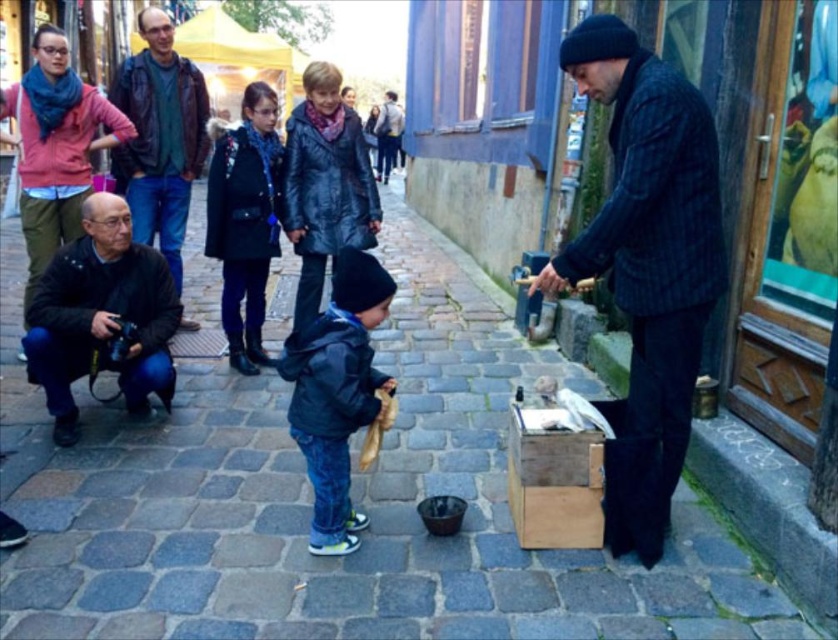
Who is positioned more to the right, dark blue textured jacket at right or dark blue denim jacket at center?

dark blue textured jacket at right is more to the right.

Does dark blue textured jacket at right appear on the left side of dark blue denim jacket at center?

No, dark blue textured jacket at right is not to the left of dark blue denim jacket at center.

Does point (643, 161) lie behind point (324, 378)?

No, it is not.

Where is `dark blue textured jacket at right`? This screenshot has width=838, height=640. dark blue textured jacket at right is located at coordinates (647, 266).

Does point (640, 396) come farther from viewer compared to point (261, 257)?

No, it is not.

What are the coordinates of `dark blue textured jacket at right` in the screenshot? It's located at (647, 266).

Looking at this image, who is positioned more to the left, smooth cobblestone pavement at center or dark blue denim jacket at center?

smooth cobblestone pavement at center is more to the left.

Can you confirm if smooth cobblestone pavement at center is positioned to the right of dark blue denim jacket at center?

In fact, smooth cobblestone pavement at center is to the left of dark blue denim jacket at center.

The height and width of the screenshot is (640, 838). Identify the location of smooth cobblestone pavement at center. (352, 497).